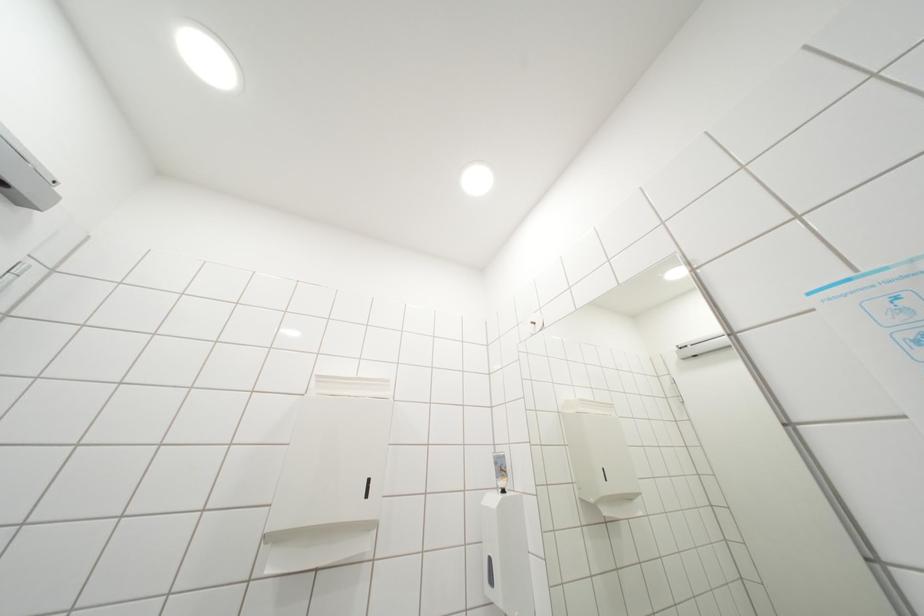
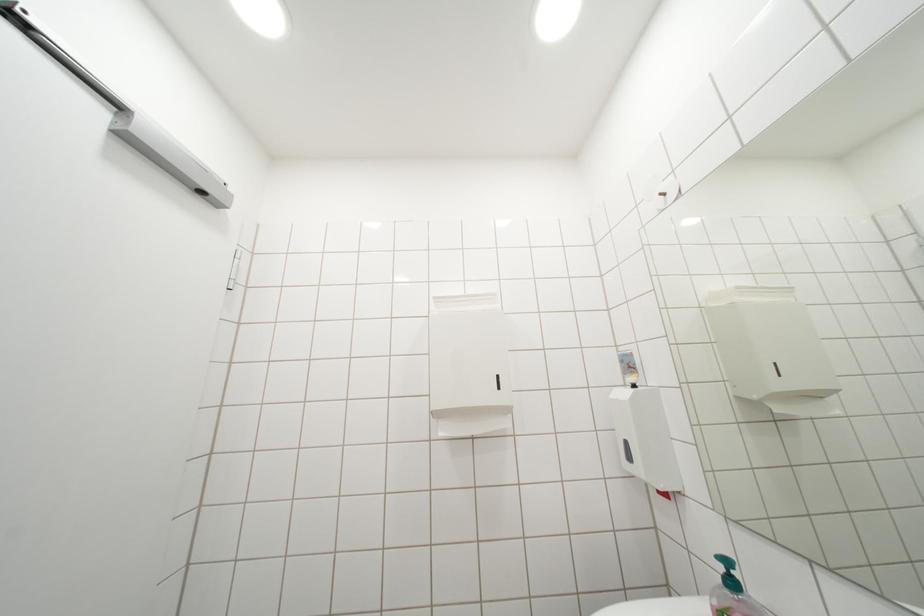
Question: What movement of the cameraman would produce the second image?

Choices:
 (A) Left
 (B) Right
 (C) Forward
 (D) Backward

Answer: (A)